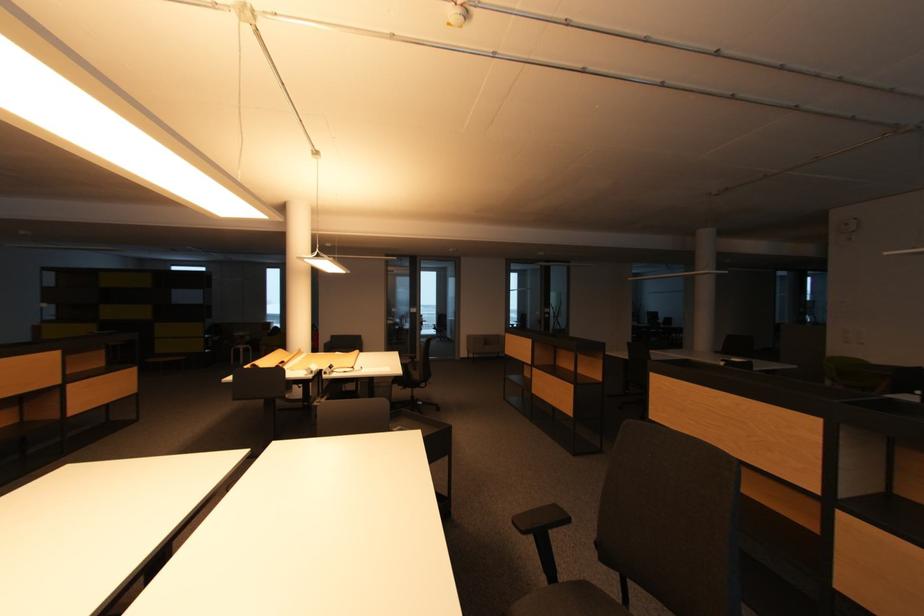
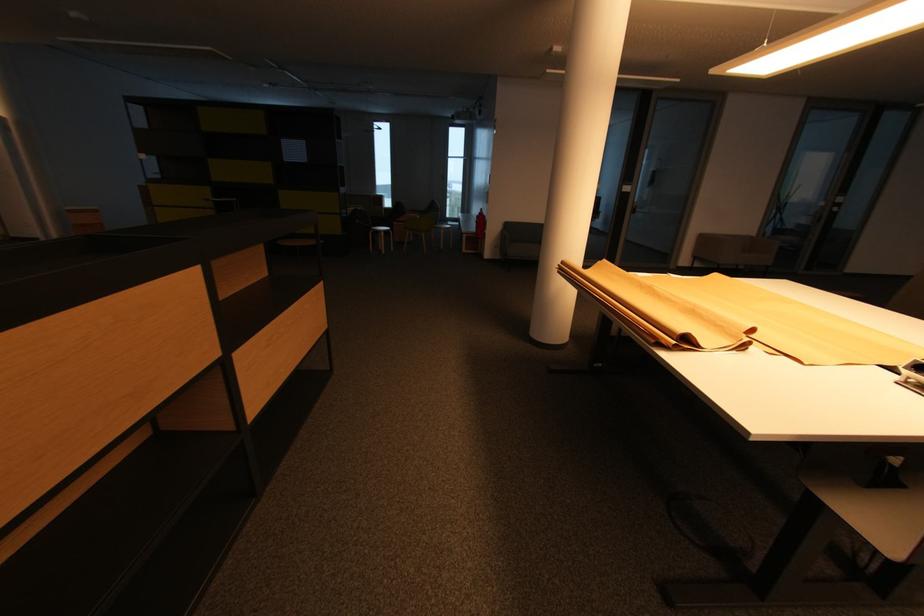
The images are taken continuously from a first-person perspective. In which direction are you moving?

The cameraman moved toward left, forward.